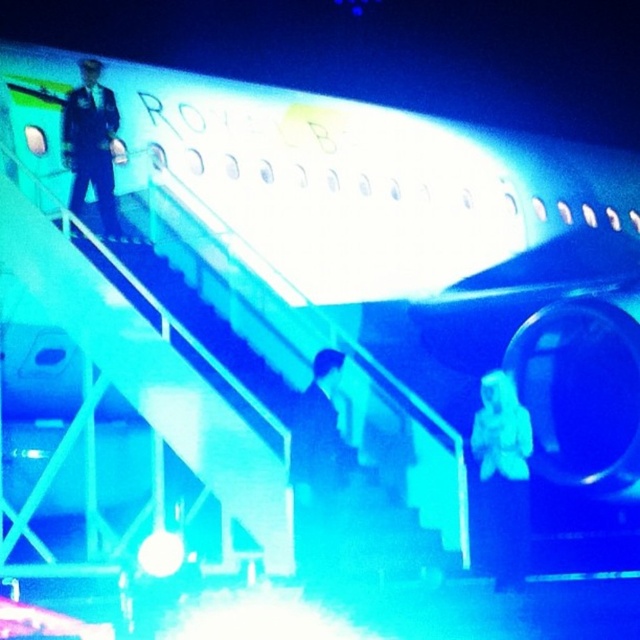
Is dark blue uniform at left thinner than dark blue suit at center?

No.

The width and height of the screenshot is (640, 640). Identify the location of dark blue uniform at left. [x=90, y=144].

Which is behind, point (81, 148) or point (342, 481)?

Positioned behind is point (81, 148).

Identify the location of dark blue uniform at left. The width and height of the screenshot is (640, 640). (90, 144).

Between white matte suit at center and dark blue suit at center, which one is positioned lower?

white matte suit at center is lower down.

Does white matte suit at center appear on the left side of dark blue suit at center?

Incorrect, white matte suit at center is not on the left side of dark blue suit at center.

Which is behind, point (500, 426) or point (310, 452)?

The point (500, 426) is behind.

Where is `white matte suit at center`? The image size is (640, 640). white matte suit at center is located at coordinates (502, 474).

Is white matte suit at center taller than dark blue uniform at left?

No, white matte suit at center is not taller than dark blue uniform at left.

Between white matte suit at center and dark blue uniform at left, which one has less height?

Standing shorter between the two is white matte suit at center.

The width and height of the screenshot is (640, 640). I want to click on white matte suit at center, so click(502, 474).